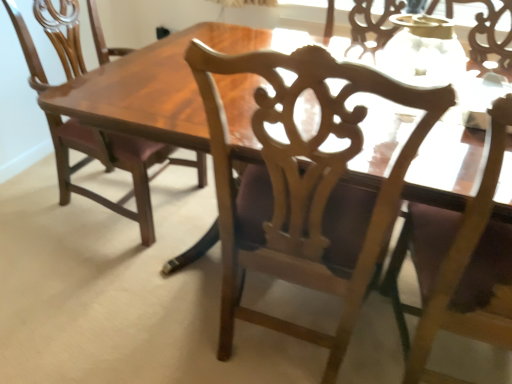
Question: Is matte wood chair at left, which appears as the first chair when viewed from the left, outside of light wood chair at upper right, marked as the third chair in a left-to-right arrangement?

Choices:
 (A) yes
 (B) no

Answer: (A)

Question: Is matte wood chair at left, acting as the third chair starting from the right, in front of light wood chair at upper right, marked as the third chair in a left-to-right arrangement?

Choices:
 (A) no
 (B) yes

Answer: (A)

Question: Considering the relative sizes of matte wood chair at left, acting as the third chair starting from the right, and light wood chair at upper right, marked as the third chair in a left-to-right arrangement, in the image provided, is matte wood chair at left, acting as the third chair starting from the right, smaller than light wood chair at upper right, marked as the third chair in a left-to-right arrangement,?

Choices:
 (A) yes
 (B) no

Answer: (B)

Question: Does matte wood chair at left, which appears as the first chair when viewed from the left, appear on the right side of light wood chair at upper right, marked as the third chair in a left-to-right arrangement?

Choices:
 (A) yes
 (B) no

Answer: (B)

Question: Is matte wood chair at left, which appears as the first chair when viewed from the left, positioned behind light wood chair at upper right, which ranks as the first chair in right-to-left order?

Choices:
 (A) no
 (B) yes

Answer: (B)

Question: From the image's perspective, is matte wood chair at left, acting as the third chair starting from the right, located above or below wooden carved chair at center, which ranks as the 2th chair in left-to-right order?

Choices:
 (A) below
 (B) above

Answer: (B)

Question: Would you say matte wood chair at left, acting as the third chair starting from the right, is inside or outside wooden carved chair at center, which ranks as the 2th chair in right-to-left order?

Choices:
 (A) inside
 (B) outside

Answer: (B)

Question: In the image, is matte wood chair at left, which appears as the first chair when viewed from the left, positioned in front of or behind wooden carved chair at center, which ranks as the 2th chair in left-to-right order?

Choices:
 (A) front
 (B) behind

Answer: (B)

Question: Looking at their shapes, would you say matte wood chair at left, acting as the third chair starting from the right, is wider or thinner than wooden carved chair at center, which ranks as the 2th chair in left-to-right order?

Choices:
 (A) thin
 (B) wide

Answer: (B)

Question: Does point (290, 109) appear closer or farther from the camera than point (507, 304)?

Choices:
 (A) farther
 (B) closer

Answer: (B)

Question: Is wooden carved chair at center, which ranks as the 2th chair in right-to-left order, situated inside light wood chair at upper right, marked as the third chair in a left-to-right arrangement, or outside?

Choices:
 (A) outside
 (B) inside

Answer: (A)

Question: In terms of size, does wooden carved chair at center, which ranks as the 2th chair in left-to-right order, appear bigger or smaller than light wood chair at upper right, which ranks as the first chair in right-to-left order?

Choices:
 (A) big
 (B) small

Answer: (B)

Question: From their relative heights in the image, would you say wooden carved chair at center, which ranks as the 2th chair in right-to-left order, is taller or shorter than light wood chair at upper right, which ranks as the first chair in right-to-left order?

Choices:
 (A) tall
 (B) short

Answer: (A)

Question: Considering their positions, is matte wood chair at left, acting as the third chair starting from the right, located in front of or behind light wood chair at upper right, which ranks as the first chair in right-to-left order?

Choices:
 (A) front
 (B) behind

Answer: (B)

Question: From a real-world perspective, is matte wood chair at left, which appears as the first chair when viewed from the left, physically located above or below light wood chair at upper right, marked as the third chair in a left-to-right arrangement?

Choices:
 (A) above
 (B) below

Answer: (B)